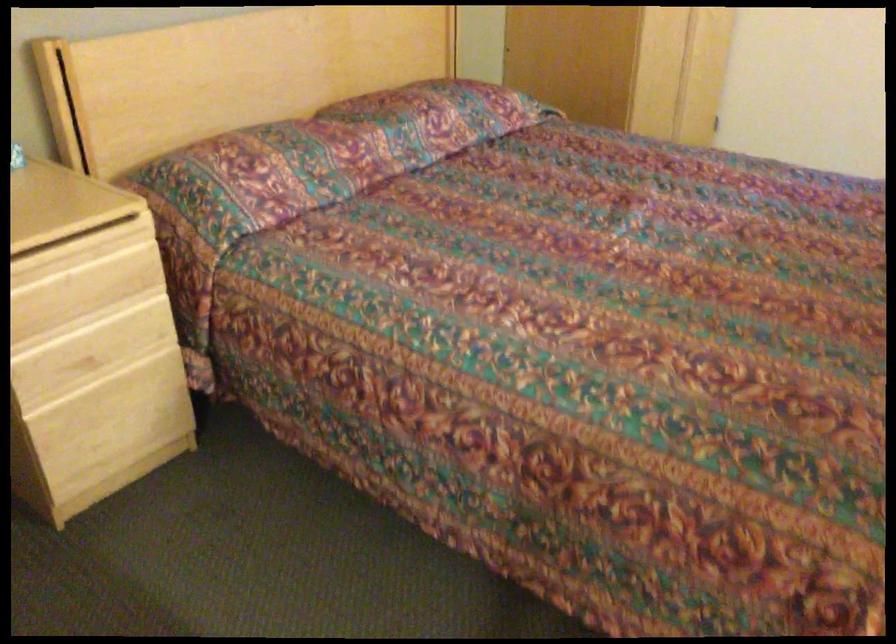
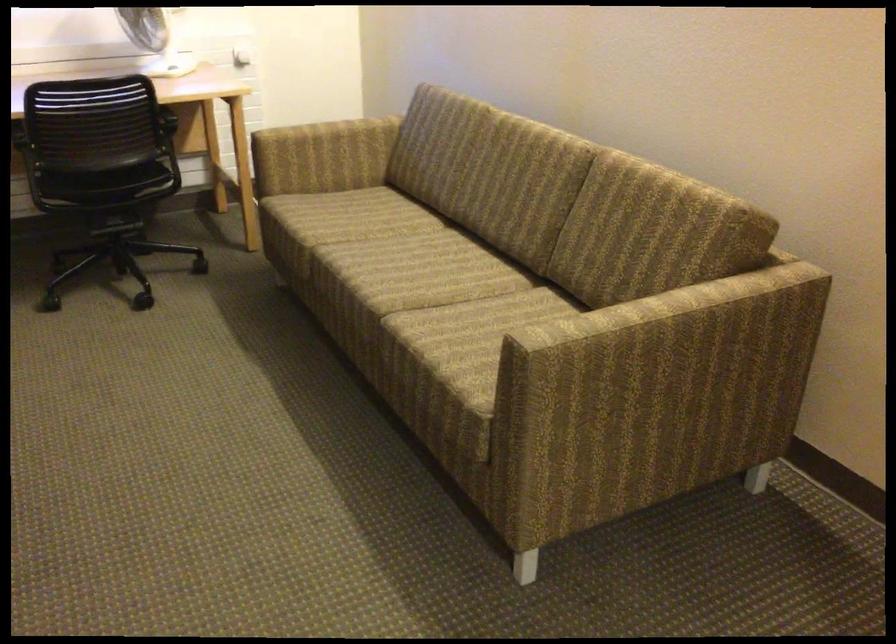
Question: The camera is either moving clockwise (left) or counter-clockwise (right) around the object. The first image is from the beginning of the video and the second image is from the end. Is the camera moving left or right when shooting the video?

Choices:
 (A) Left
 (B) Right

Answer: (A)